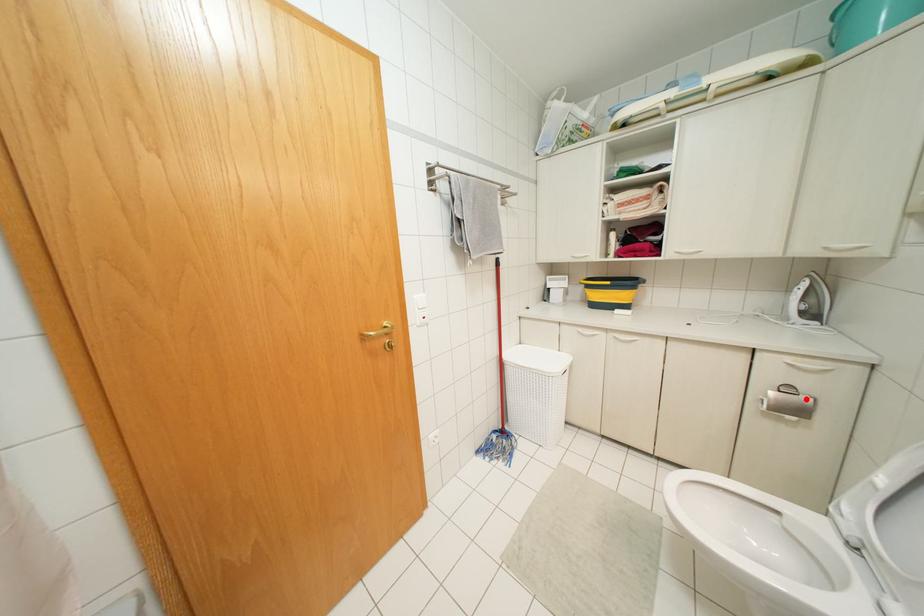
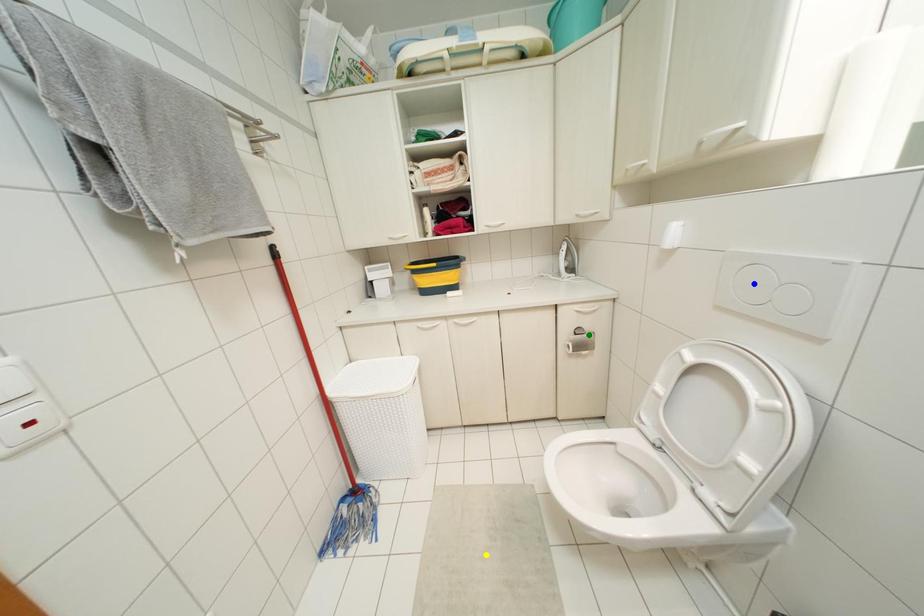
Question: I am providing you with two images of the same scene from different viewpoints. A red point is marked on the first image. You are given multiple points on the second image. In image 2, which mark is for the same physical point as the one in image 1?

Choices:
 (A) green point
 (B) yellow point
 (C) blue point

Answer: (A)